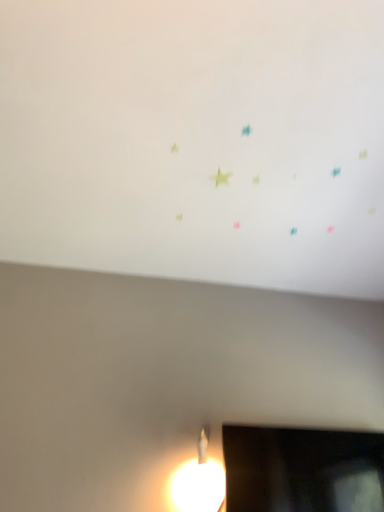
Question: Is point (369, 246) positioned closer to the camera than point (377, 487)?

Choices:
 (A) closer
 (B) farther

Answer: (B)

Question: Is white matte wall at upper center inside or outside of black glossy television at lower right?

Choices:
 (A) inside
 (B) outside

Answer: (B)

Question: From the image's perspective, is white matte wall at upper center located above or below black glossy television at lower right?

Choices:
 (A) above
 (B) below

Answer: (A)

Question: In the image, is black glossy television at lower right positioned in front of or behind white matte wall at upper center?

Choices:
 (A) behind
 (B) front

Answer: (A)

Question: In terms of size, does black glossy television at lower right appear bigger or smaller than white matte wall at upper center?

Choices:
 (A) big
 (B) small

Answer: (B)

Question: In the image, is black glossy television at lower right on the left side or the right side of white matte wall at upper center?

Choices:
 (A) left
 (B) right

Answer: (B)

Question: Considering the positions of black glossy television at lower right and white matte wall at upper center in the image, is black glossy television at lower right wider or thinner than white matte wall at upper center?

Choices:
 (A) wide
 (B) thin

Answer: (B)